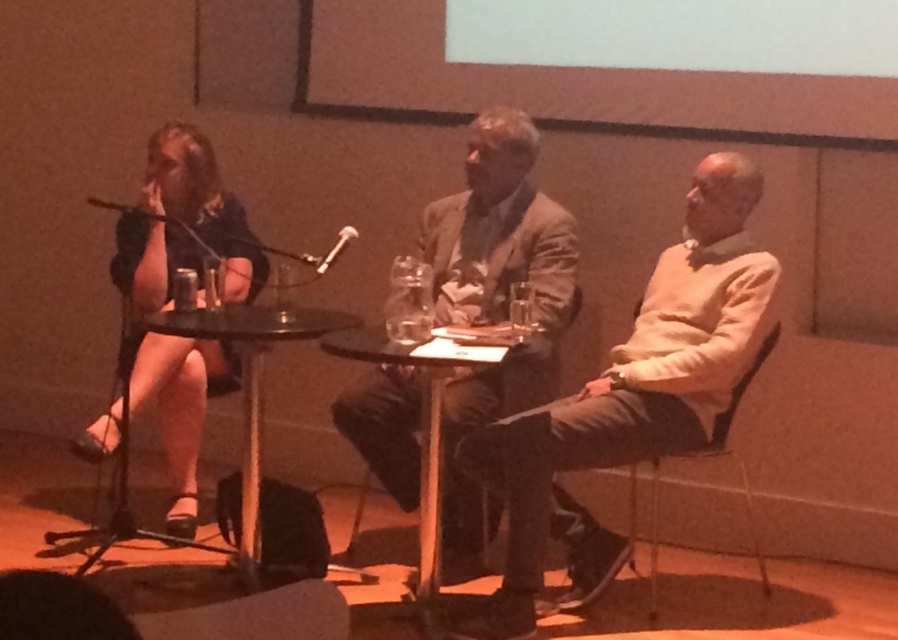
Question: Which object is farther from the camera taking this photo?

Choices:
 (A) metallic gray chair at right
 (B) light brown sweater at right
 (C) matte black dress at left
 (D) transparent glass table at center

Answer: (C)

Question: Among these objects, which one is nearest to the camera?

Choices:
 (A) transparent glass table at center
 (B) light brown leather jacket at center
 (C) matte black dress at left

Answer: (A)

Question: Can you confirm if light brown sweater at right is positioned to the left of metallic gray chair at right?

Choices:
 (A) yes
 (B) no

Answer: (A)

Question: Does transparent glass table at center have a smaller size compared to black glass table at center?

Choices:
 (A) no
 (B) yes

Answer: (A)

Question: Which object is the farthest from the transparent glass table at center?

Choices:
 (A) light brown leather jacket at center
 (B) light brown sweater at right
 (C) metallic gray chair at right

Answer: (C)

Question: Is light brown sweater at right to the left of light brown leather jacket at center from the viewer's perspective?

Choices:
 (A) no
 (B) yes

Answer: (A)